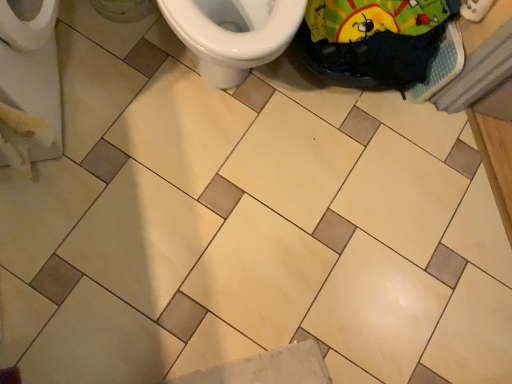
Question: Would you say white glossy toilet at upper center is inside or outside green fabric bag at upper right?

Choices:
 (A) outside
 (B) inside

Answer: (A)

Question: Based on their sizes in the image, would you say white glossy toilet at upper center is bigger or smaller than green fabric bag at upper right?

Choices:
 (A) big
 (B) small

Answer: (A)

Question: Would you say white glossy toilet at upper center is to the left or to the right of green fabric bag at upper right in the picture?

Choices:
 (A) right
 (B) left

Answer: (B)

Question: In the image, is green fabric bag at upper right positioned in front of or behind white glossy toilet at upper center?

Choices:
 (A) behind
 (B) front

Answer: (A)

Question: Considering the positions of point (365, 84) and point (268, 39), is point (365, 84) closer or farther from the camera than point (268, 39)?

Choices:
 (A) farther
 (B) closer

Answer: (A)

Question: From a real-world perspective, is green fabric bag at upper right above or below white glossy toilet at upper center?

Choices:
 (A) below
 (B) above

Answer: (A)

Question: Considering the positions of green fabric bag at upper right and white glossy toilet at upper center in the image, is green fabric bag at upper right wider or thinner than white glossy toilet at upper center?

Choices:
 (A) wide
 (B) thin

Answer: (B)